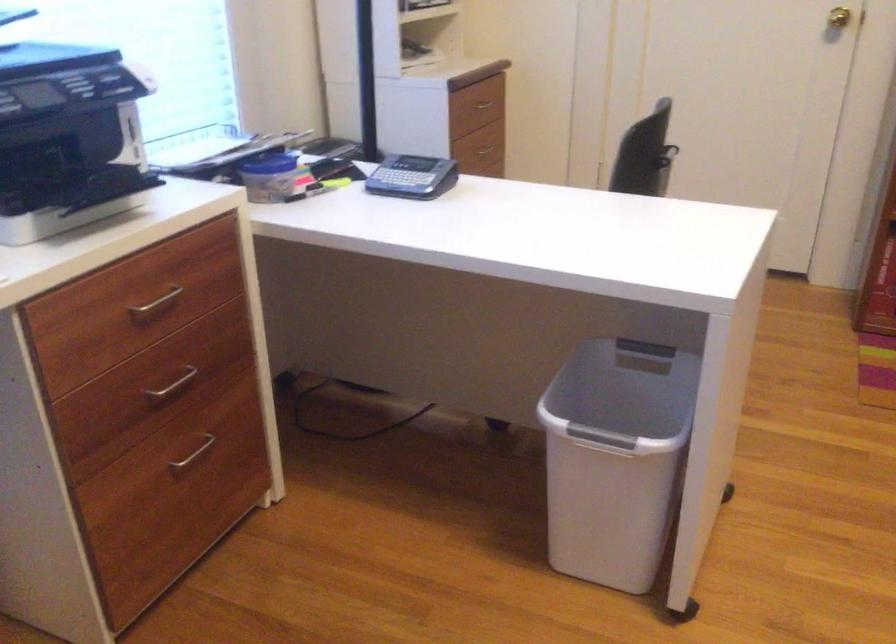
The height and width of the screenshot is (644, 896). I want to click on trash can lid handle, so click(x=625, y=389).